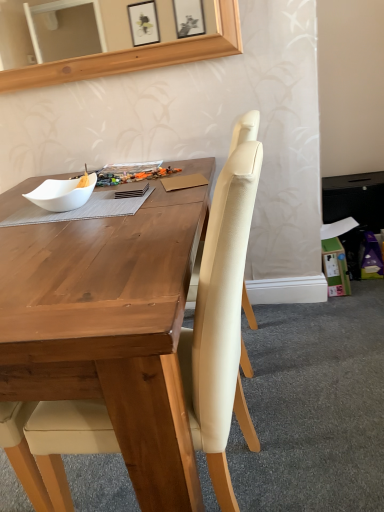
I want to click on white matte bowl at left, so click(x=61, y=194).

Locate an element on the screen. Image resolution: width=384 pixels, height=512 pixels. green cardboard box at lower right is located at coordinates (335, 267).

Between green cardboard box at lower right and white matte bowl at left, which one has smaller width?

With smaller width is white matte bowl at left.

At what (x,y) coordinates should I click in order to perform the action: click on bowl on the left of green cardboard box at lower right. Please return your answer as a coordinate pair (x, y). Looking at the image, I should click on (61, 194).

Considering the relative sizes of green cardboard box at lower right and white matte bowl at left in the image provided, is green cardboard box at lower right shorter than white matte bowl at left?

Incorrect, the height of green cardboard box at lower right does not fall short of that of white matte bowl at left.

Which point is more forward, (234, 164) or (337, 268)?

The point (234, 164) is closer to the camera.

From the image's perspective, is beige fabric chair at center beneath green cardboard box at lower right?

Correct, beige fabric chair at center appears lower than green cardboard box at lower right in the image.

How many degrees apart are the facing directions of beige fabric chair at center and green cardboard box at lower right?

The angle between the facing direction of beige fabric chair at center and the facing direction of green cardboard box at lower right is 176 degrees.

Are beige fabric chair at center and green cardboard box at lower right making contact?

No, beige fabric chair at center is not in contact with green cardboard box at lower right.

Which object is positioned more to the right, white matte bowl at left or beige fabric chair at center?

Positioned to the right is beige fabric chair at center.

Is white matte bowl at left located outside beige fabric chair at center?

white matte bowl at left lies outside beige fabric chair at center's area.

From the image's perspective, between white matte bowl at left and beige fabric chair at center, which one is located above?

white matte bowl at left.

Is green cardboard box at lower right looking in the opposite direction of beige fabric chair at center?

That's not correct — green cardboard box at lower right is not looking away from beige fabric chair at center.

Does green cardboard box at lower right have a smaller size compared to beige fabric chair at center?

Yes.

Would you say beige fabric chair at center is to the left or to the right of white matte bowl at left in the picture?

beige fabric chair at center is positioned on white matte bowl at left's right side.

From a real-world perspective, between beige fabric chair at center and white matte bowl at left, who is vertically higher?

white matte bowl at left.

Can you confirm if beige fabric chair at center is shorter than white matte bowl at left?

In fact, beige fabric chair at center may be taller than white matte bowl at left.

From the image's perspective, relative to green cardboard box at lower right, is white matte bowl at left above or below?

Clearly, from the image's perspective, white matte bowl at left is above green cardboard box at lower right.

Considering the sizes of objects white matte bowl at left and green cardboard box at lower right in the image provided, who is taller, white matte bowl at left or green cardboard box at lower right?

Standing taller between the two is green cardboard box at lower right.

Is white matte bowl at left positioned far away from green cardboard box at lower right?

Yes, white matte bowl at left and green cardboard box at lower right are located far from each other.

Identify the location of box below the white matte bowl at left (from the image's perspective). (335, 267).

At what (x,y) coordinates should I click in order to perform the action: click on bowl on the left of green cardboard box at lower right. Please return your answer as a coordinate pair (x, y). Image resolution: width=384 pixels, height=512 pixels. Looking at the image, I should click on (61, 194).

Where is `chair above the green cardboard box at lower right (from a real-world perspective)`? chair above the green cardboard box at lower right (from a real-world perspective) is located at coordinates pos(221,322).

Which object lies nearer to the anchor point white matte bowl at left, beige fabric chair at center or green cardboard box at lower right?

Among the two, beige fabric chair at center is located nearer to white matte bowl at left.

Looking at the image, which one is located closer to white matte bowl at left, green cardboard box at lower right or beige fabric chair at center?

beige fabric chair at center lies closer to white matte bowl at left than the other object.

Which object lies further to the anchor point green cardboard box at lower right, beige fabric chair at center or white matte bowl at left?

Among the two, beige fabric chair at center is located further to green cardboard box at lower right.

Estimate the real-world distances between objects in this image. Which object is closer to beige fabric chair at center, green cardboard box at lower right or white matte bowl at left?

white matte bowl at left.

Looking at the image, which one is located further to beige fabric chair at center, white matte bowl at left or green cardboard box at lower right?

green cardboard box at lower right lies further to beige fabric chair at center than the other object.

Based on their spatial positions, is white matte bowl at left or beige fabric chair at center further from green cardboard box at lower right?

Among the two, beige fabric chair at center is located further to green cardboard box at lower right.

Where is `bowl between beige fabric chair at center and green cardboard box at lower right along the z-axis`? bowl between beige fabric chair at center and green cardboard box at lower right along the z-axis is located at coordinates (61, 194).